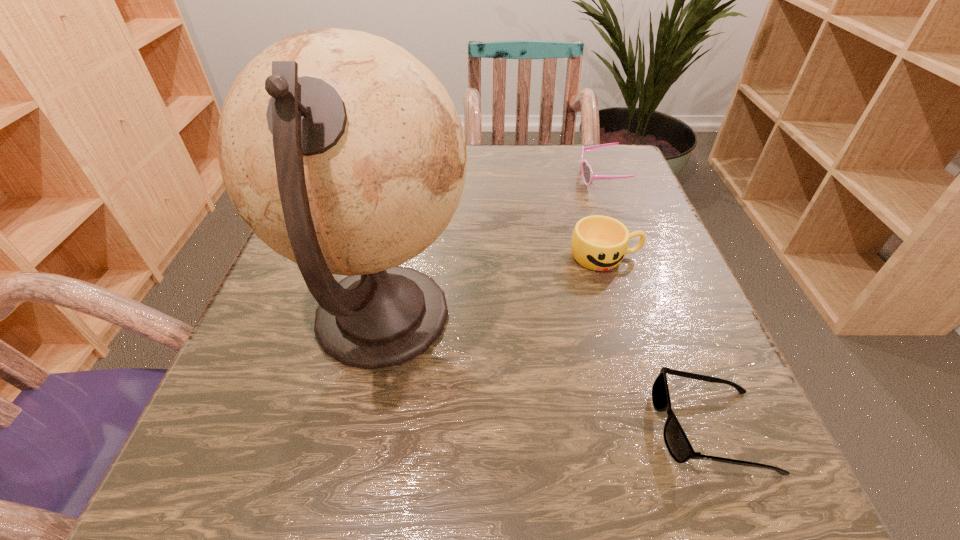
In the image, there is a desktop. At what (x,y) coordinates should I click in order to perform the action: click on free region at the far edge. Please return your answer as a coordinate pair (x, y). Image resolution: width=960 pixels, height=540 pixels. Looking at the image, I should click on (546, 182).

In the image, there is a desktop. Where is `vacant space at the near edge`? The height and width of the screenshot is (540, 960). vacant space at the near edge is located at coordinates (625, 504).

Locate an element on the screen. The image size is (960, 540). free space at the left edge of the desktop is located at coordinates (283, 283).

Locate an element on the screen. The image size is (960, 540). free space at the right edge of the desktop is located at coordinates (756, 440).

Locate an element on the screen. The height and width of the screenshot is (540, 960). free space at the far right corner of the desktop is located at coordinates (648, 194).

I want to click on vacant area between the nearer sunglasses and the cup, so click(x=658, y=342).

Identify the location of vacant area that lies between the shortest object and the globe. The height and width of the screenshot is (540, 960). (546, 373).

You are a GUI agent. You are given a task and a screenshot of the screen. Output one action in this format:
    pyautogui.click(x=<x>, y=<y>)
    Task: Click on the free area in between the shorter sunglasses and the globe
    The image size is (960, 540).
    Given the screenshot: What is the action you would take?
    pyautogui.click(x=546, y=373)

Find the location of `free area in between the globe and the nearer sunglasses`. free area in between the globe and the nearer sunglasses is located at coordinates (546, 373).

Identify the location of empty location between the cup and the globe. (493, 287).